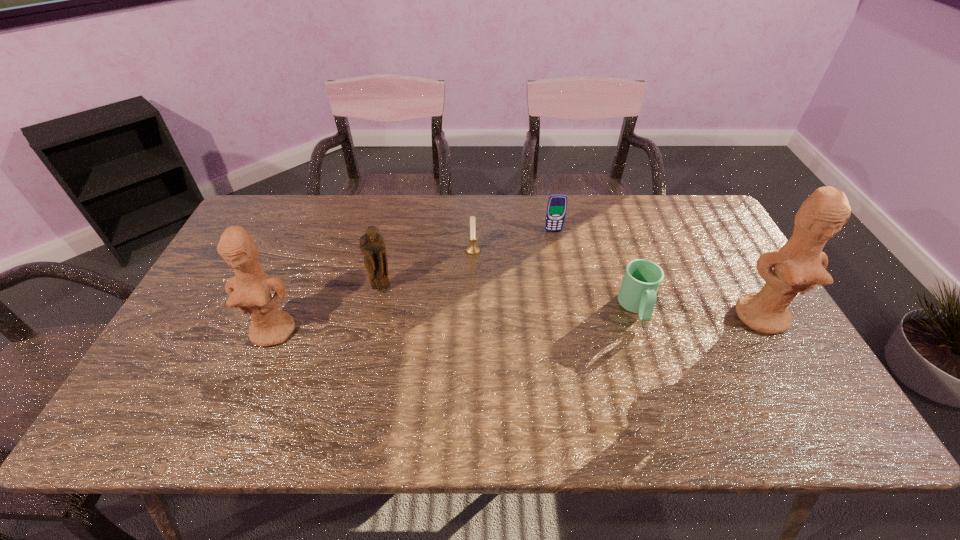
Find the location of a particular element. The height and width of the screenshot is (540, 960). free location at the near edge is located at coordinates (606, 384).

This screenshot has width=960, height=540. In the image, there is a desktop. Find the location of `free space at the left edge`. free space at the left edge is located at coordinates (211, 303).

I want to click on free space at the right edge of the desktop, so click(732, 324).

At what (x,y) coordinates should I click in order to perform the action: click on vacant space at the far left corner of the desktop. Please return your answer as a coordinate pair (x, y). This screenshot has height=540, width=960. Looking at the image, I should click on (275, 205).

This screenshot has width=960, height=540. In the image, there is a desktop. Find the location of `free space at the near right corner`. free space at the near right corner is located at coordinates (765, 373).

Locate an element on the screen. The width and height of the screenshot is (960, 540). free space between the mug and the fourth object from right to left is located at coordinates (555, 279).

The width and height of the screenshot is (960, 540). Identify the location of empty location between the second tallest figurine and the tallest object. (518, 324).

Image resolution: width=960 pixels, height=540 pixels. Identify the location of vacant space that's between the fourth object from right to left and the farthest figurine. (428, 270).

Where is `vacant area that lies between the second tallest figurine and the cellular telephone`? vacant area that lies between the second tallest figurine and the cellular telephone is located at coordinates (414, 281).

Locate an element on the screen. Image resolution: width=960 pixels, height=540 pixels. vacant space that is in between the third tallest object and the rightmost object is located at coordinates (572, 303).